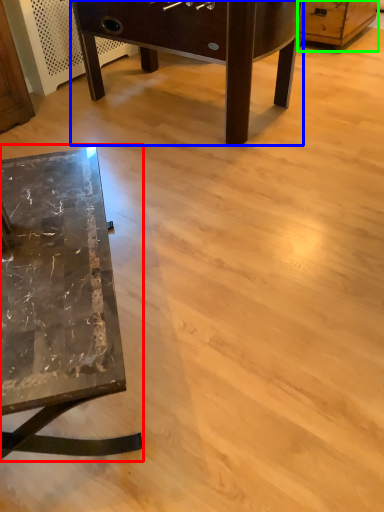
Question: Which object is positioned farthest from table (highlighted by a red box)? Select from table (highlighted by a blue box) and dresser (highlighted by a green box).

Choices:
 (A) table
 (B) dresser

Answer: (B)